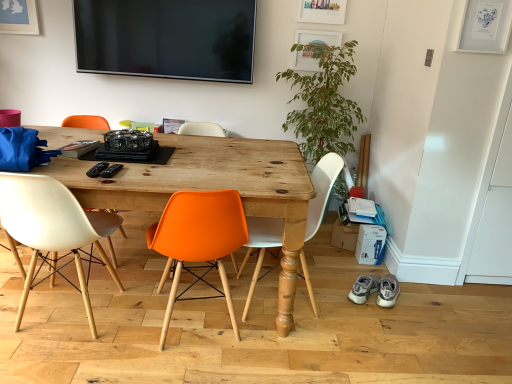
Question: Could wooden table at center be considered to be inside green leafy plant at right?

Choices:
 (A) yes
 (B) no

Answer: (B)

Question: From the image's perspective, is green leafy plant at right over wooden table at center?

Choices:
 (A) yes
 (B) no

Answer: (A)

Question: Considering the relative sizes of green leafy plant at right and wooden table at center in the image provided, is green leafy plant at right smaller than wooden table at center?

Choices:
 (A) no
 (B) yes

Answer: (B)

Question: Is green leafy plant at right touching wooden table at center?

Choices:
 (A) yes
 (B) no

Answer: (B)

Question: Is green leafy plant at right positioned in front of wooden table at center?

Choices:
 (A) no
 (B) yes

Answer: (A)

Question: Considering their positions, is green leafy plant at right located in front of or behind white matte chair at center, acting as the 1th chair starting from the right?

Choices:
 (A) front
 (B) behind

Answer: (B)

Question: From their relative heights in the image, would you say green leafy plant at right is taller or shorter than white matte chair at center, the third chair viewed from the left?

Choices:
 (A) tall
 (B) short

Answer: (A)

Question: Does point (337, 135) appear closer or farther from the camera than point (266, 225)?

Choices:
 (A) closer
 (B) farther

Answer: (B)

Question: Looking at the image, does green leafy plant at right seem bigger or smaller compared to white matte chair at center, the third chair viewed from the left?

Choices:
 (A) small
 (B) big

Answer: (B)

Question: Based on their positions, is white matte chair at center, the third chair viewed from the left, located to the left or right of orange plastic chair at center, which appears as the second chair when viewed from the right?

Choices:
 (A) right
 (B) left

Answer: (A)

Question: Relative to orange plastic chair at center, which appears as the 2th chair when viewed from the left, is white matte chair at center, the third chair viewed from the left, in front or behind?

Choices:
 (A) behind
 (B) front

Answer: (A)

Question: Is white matte chair at center, the third chair viewed from the left, wider or thinner than orange plastic chair at center, which appears as the second chair when viewed from the right?

Choices:
 (A) thin
 (B) wide

Answer: (A)

Question: Considering the positions of white matte chair at center, acting as the 1th chair starting from the right, and orange plastic chair at center, which appears as the second chair when viewed from the right, in the image, is white matte chair at center, acting as the 1th chair starting from the right, taller or shorter than orange plastic chair at center, which appears as the second chair when viewed from the right,?

Choices:
 (A) short
 (B) tall

Answer: (B)

Question: Would you say gray suede sneakers at lower right, positioned as the first footwear in left-to-right order, is to the left or to the right of wooden table at center in the picture?

Choices:
 (A) left
 (B) right

Answer: (B)

Question: From a real-world perspective, is gray suede sneakers at lower right, the second footwear viewed from the right, physically located above or below wooden table at center?

Choices:
 (A) above
 (B) below

Answer: (B)